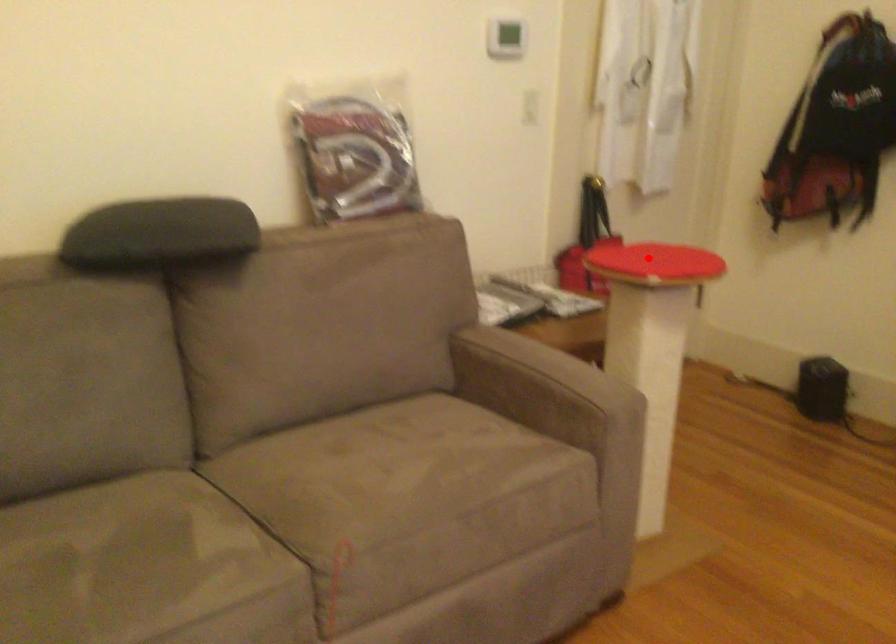
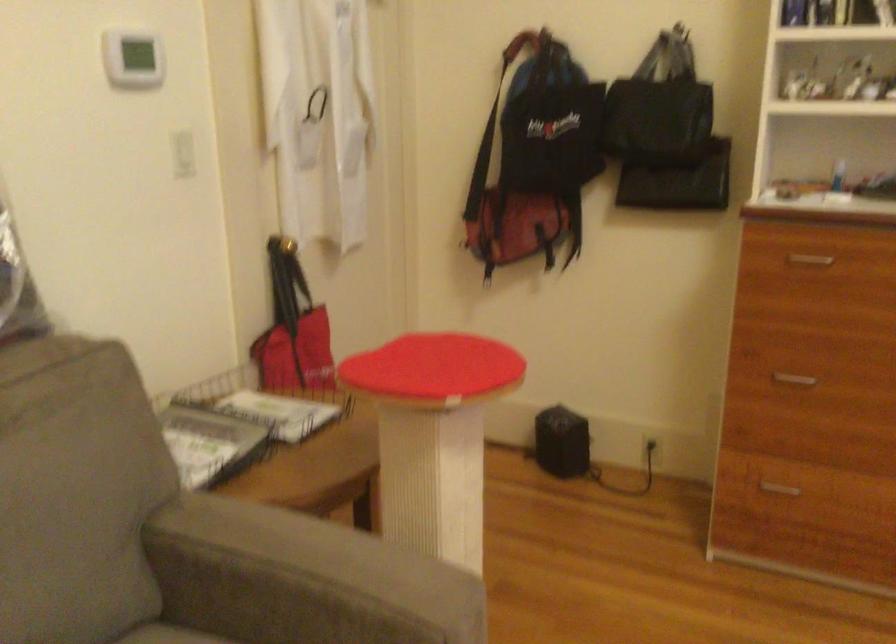
Question: I am providing you with two images of the same scene from different viewpoints. Image1 has a red point marked. In image2, the corresponding 3D location appears at what relative position? Reply with the corresponding letter.

Choices:
 (A) Closer
 (B) Farther

Answer: (A)